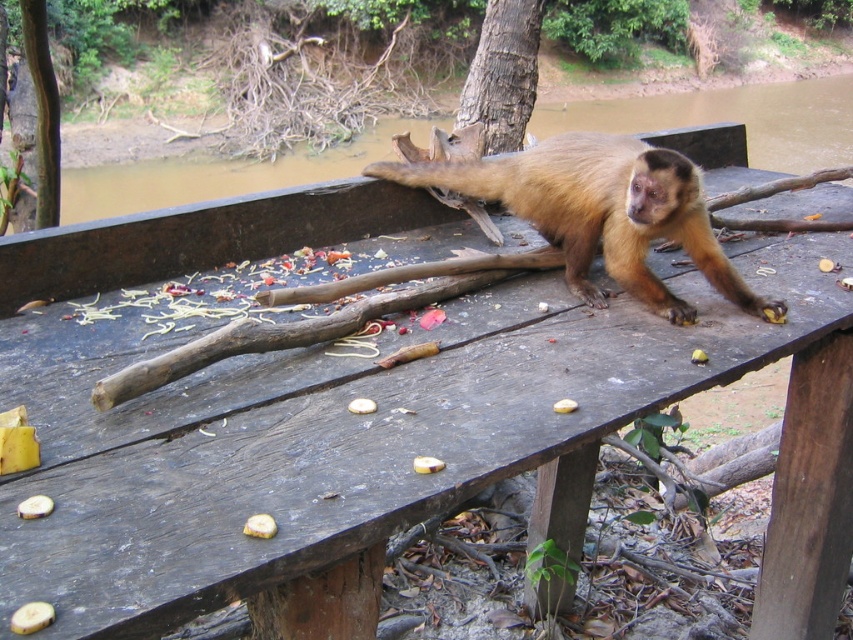
Can you confirm if brown fur tail at center is positioned to the right of yellow matte banana at lower left?

Correct, you'll find brown fur tail at center to the right of yellow matte banana at lower left.

Who is more distant from viewer, (480, 188) or (265, 531)?

Point (480, 188)

Is point (509, 172) positioned before point (248, 531)?

No, it is not.

Where is `brown fur tail at center`? This screenshot has height=640, width=853. brown fur tail at center is located at coordinates (450, 176).

Is point (20, 612) farther from viewer compared to point (51, 506)?

No, it is in front of (51, 506).

Is yellow matte fruit at center in front of yellow matte fruit at lower left?

That is True.

The width and height of the screenshot is (853, 640). Identify the location of yellow matte fruit at center. (32, 618).

How far apart are brown furry monkey at center and brown rough bark tree at upper center?

brown furry monkey at center and brown rough bark tree at upper center are 3.17 meters apart.

Between point (624, 241) and point (486, 61), which one is positioned in front?

Point (624, 241)

Locate an element on the screen. This screenshot has height=640, width=853. brown furry monkey at center is located at coordinates (601, 212).